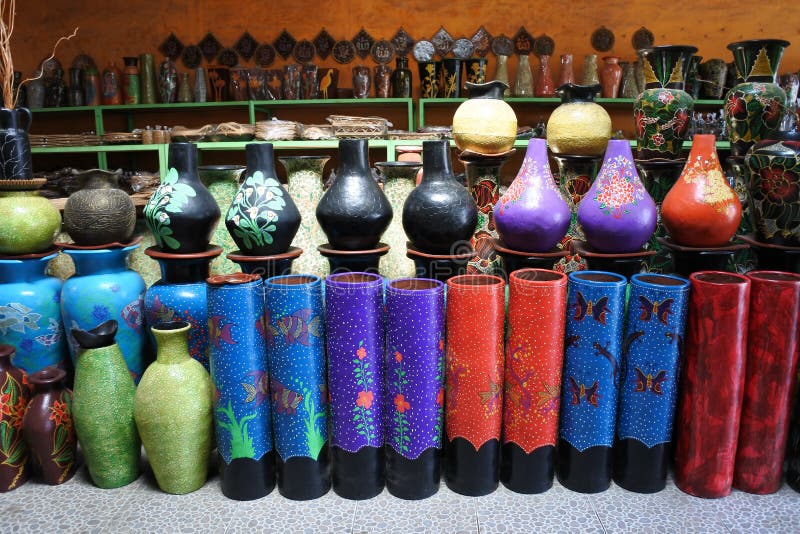
Identify the location of blue vase. [x=78, y=300], [x=52, y=301].